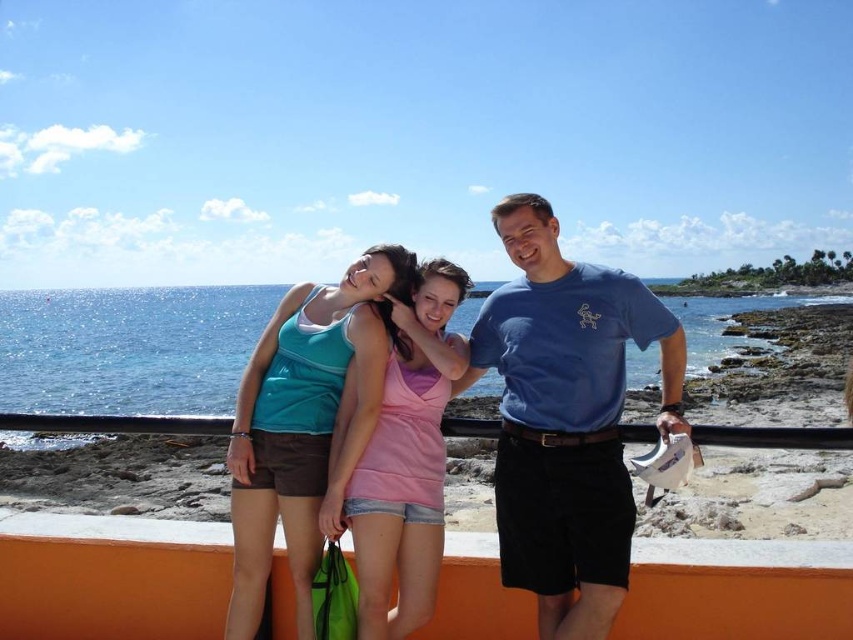
Question: Does blue cotton t-shirt at center have a larger size compared to matte teal tank top at center?

Choices:
 (A) no
 (B) yes

Answer: (B)

Question: Considering the real-world distances, which object is farthest from the blue cotton t-shirt at center?

Choices:
 (A) pink fabric tank top at center
 (B) orange concrete ledge at lower center
 (C) matte teal tank top at center

Answer: (B)

Question: Which of the following is the farthest from the observer?

Choices:
 (A) black metal rail at center
 (B) matte teal tank top at center

Answer: (B)

Question: Which of the following is the farthest from the observer?

Choices:
 (A) (606, 416)
 (B) (13, 596)
 (C) (387, 444)
 (D) (248, 465)

Answer: (B)

Question: Considering the relative positions of blue cotton t-shirt at center and matte teal tank top at center in the image provided, where is blue cotton t-shirt at center located with respect to matte teal tank top at center?

Choices:
 (A) below
 (B) above

Answer: (B)

Question: Does orange concrete ledge at lower center appear on the left side of matte teal tank top at center?

Choices:
 (A) yes
 (B) no

Answer: (B)